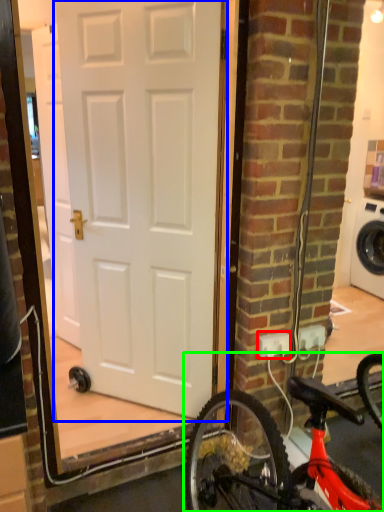
Question: Which object is positioned farthest from electric outlet (highlighted by a red box)? Select from door (highlighted by a blue box) and bicycle (highlighted by a green box).

Choices:
 (A) door
 (B) bicycle

Answer: (A)